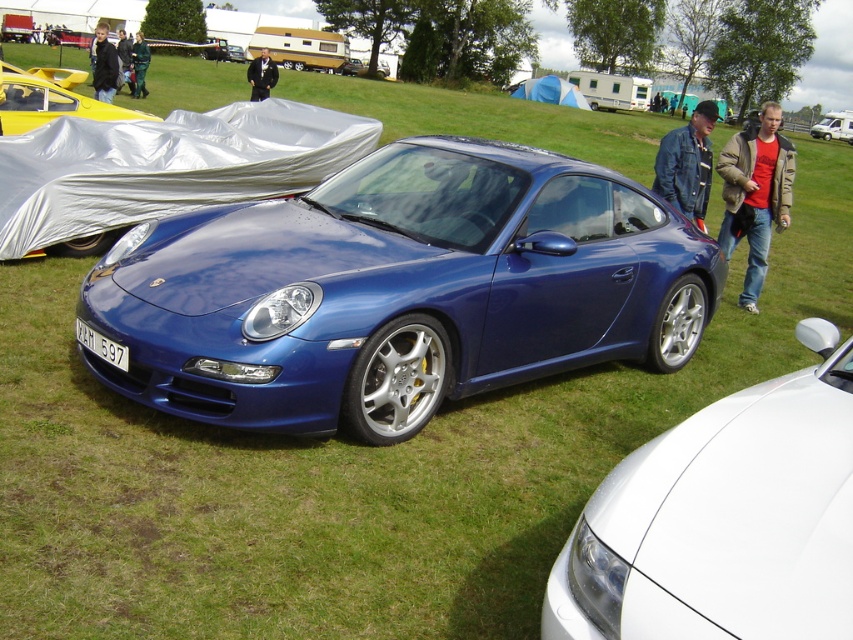
Is white plastic license plate at center shorter than black suit at center?

Yes, white plastic license plate at center is shorter than black suit at center.

Can you confirm if white plastic license plate at center is positioned to the left of black suit at center?

In fact, white plastic license plate at center is to the right of black suit at center.

Between point (119, 358) and point (256, 88), which one is positioned behind?

The point (256, 88) is behind.

Locate an element on the screen. white plastic license plate at center is located at coordinates (102, 346).

Does denim jacket at upper right appear on the right side of white plastic license plate at center?

Yes, denim jacket at upper right is to the right of white plastic license plate at center.

Who is lower down, denim jacket at upper right or white plastic license plate at center?

white plastic license plate at center is below.

Locate an element on the screen. Image resolution: width=853 pixels, height=640 pixels. denim jacket at upper right is located at coordinates (688, 163).

Describe the element at coordinates (688, 163) in the screenshot. The image size is (853, 640). I see `denim jacket at upper right` at that location.

Between denim jacket at upper right and metallic silver car at center, which one appears on the right side from the viewer's perspective?

Positioned to the right is denim jacket at upper right.

Is point (704, 106) farther from camera compared to point (354, 58)?

No, (704, 106) is closer to viewer.

The image size is (853, 640). I want to click on denim jacket at upper right, so click(x=688, y=163).